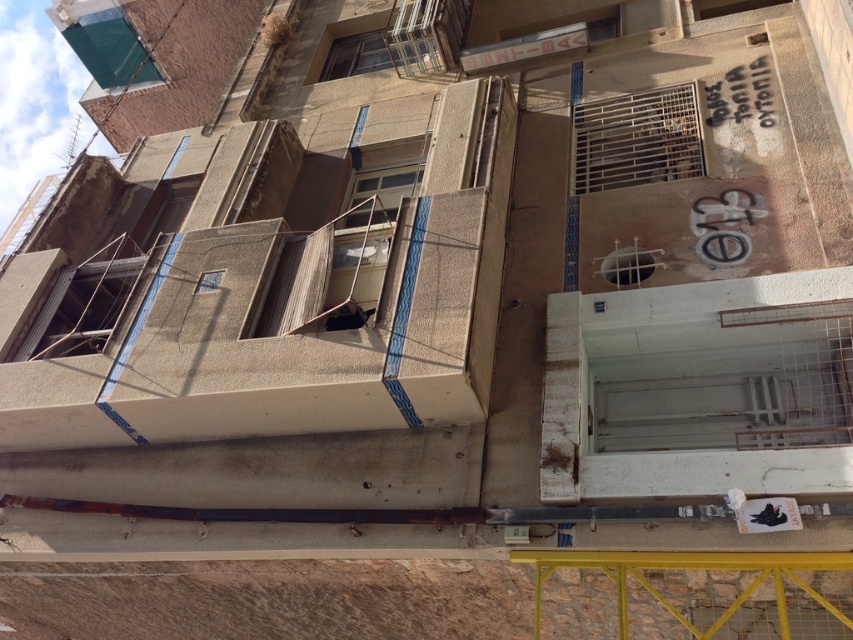
Is concrete textured balcony at center wider than white concrete balcony at lower right?

No, concrete textured balcony at center is not wider than white concrete balcony at lower right.

Does concrete textured balcony at center have a smaller size compared to white concrete balcony at lower right?

Answer: Yes, concrete textured balcony at center is smaller than white concrete balcony at lower right.

Which is in front, point (171, 429) or point (851, 289)?

Point (851, 289) is more forward.

Find the location of a particular element. concrete textured balcony at center is located at coordinates (297, 308).